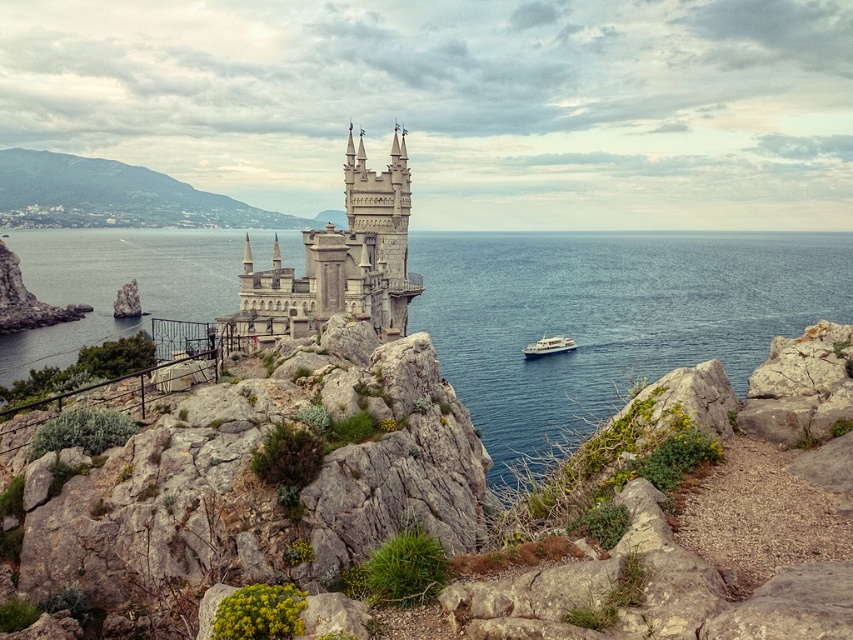
You are standing on the cliff and want to take a photo of both the stone castle at center and the green grassy hillside at upper left. Which object should you focus on first to ensure both are in clear view?

You should focus on the stone castle at center first because it is closer to you than the green grassy hillside at upper left, so adjusting focus starting from the closer object ensures both are in clear view.